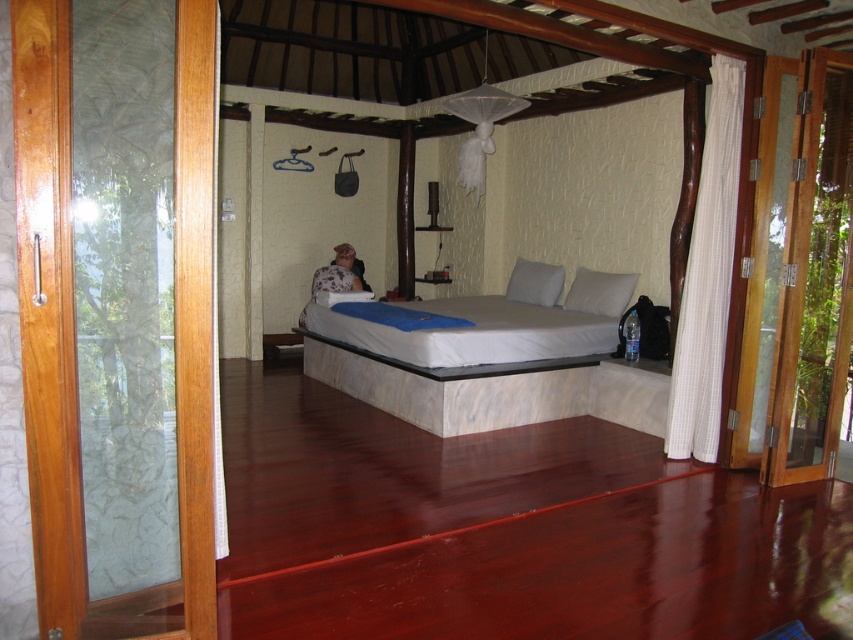
Does white matte pillow at center have a lesser height compared to floral fabric woman at center?

Yes, white matte pillow at center is shorter than floral fabric woman at center.

Which of these two, white matte pillow at center or floral fabric woman at center, stands taller?

floral fabric woman at center

Does point (515, 296) lie behind point (312, 291)?

That is True.

You are a GUI agent. You are given a task and a screenshot of the screen. Output one action in this format:
    pyautogui.click(x=<x>, y=<y>)
    Task: Click on the white matte pillow at center
    The width and height of the screenshot is (853, 640).
    Given the screenshot: What is the action you would take?
    point(535,282)

Is point (538, 394) closer to viewer compared to point (347, 268)?

That is True.

Is point (378, 337) positioned before point (329, 276)?

Yes.

I want to click on white marble bed at center, so click(x=492, y=362).

Is point (467, 387) positioned before point (521, 262)?

That is True.

Can you confirm if white marble bed at center is shorter than white matte pillow at center?

No.

Which is behind, point (416, 301) or point (544, 275)?

The point (544, 275) is behind.

You are a GUI agent. You are given a task and a screenshot of the screen. Output one action in this format:
    pyautogui.click(x=<x>, y=<y>)
    Task: Click on the white marble bed at center
    The image size is (853, 640).
    Given the screenshot: What is the action you would take?
    pyautogui.click(x=492, y=362)